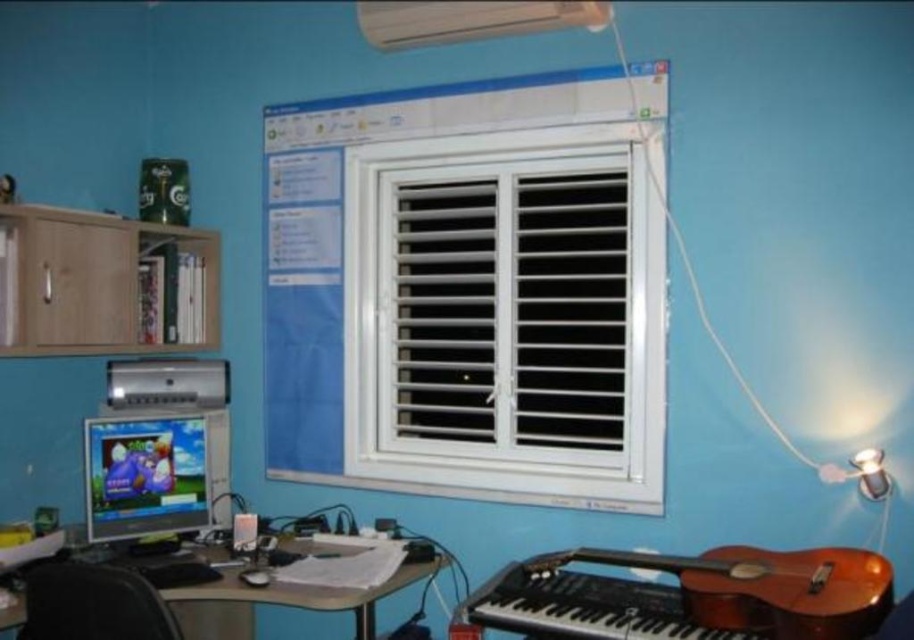
You are a person who is 5 feet tall. You want to sit in the black leather chair at lower left and look at the white plastic window at center. Can you see the window from the chair without moving your head?

The white plastic window at center and black leather chair at lower left are 4.27 feet apart. Since the chair is at lower left and the window is at center, and the desk with a computer monitor is between them, the monitor might block the view. However, the distance is sufficient for the person to see the window if they can move slightly or adjust their position. The answer would depend on the exact arrangement, but based on the given info, it is possible.

You are sitting at the desk and want to place a new keyboard that is the same size as the black plastic keyboard at lower center on the desk. Is there enough vertical space between the white plastic window at center and the existing keyboard to fit the new one without overlapping?

The white plastic window at center has a greater height compared to the black plastic keyboard at lower center. Since the window is taller, there is sufficient vertical space between them to place the new keyboard without overlapping.

You are sitting at the desk and want to reach the white plastic window at center to adjust the blinds. However, there is a black plastic keyboard at lower center in the way. Can you move the keyboard to access the window?

The white plastic window at center is above the black plastic keyboard at lower center, so you can reach the window without moving the keyboard since it is positioned higher.